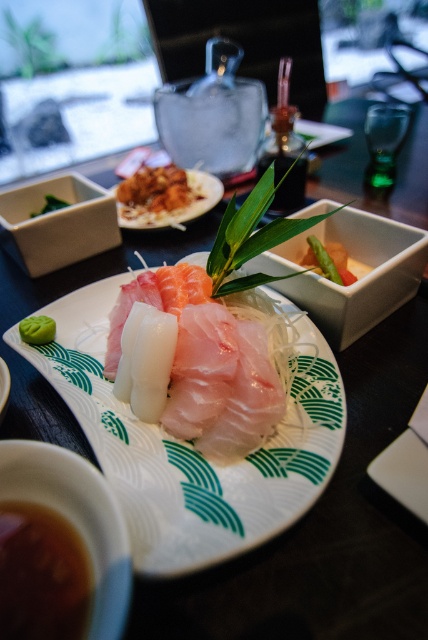
From the picture: Which is above, brown translucent bowl at lower left or white matte bowl at center-left?

Positioned higher is white matte bowl at center-left.

Which is more to the left, brown translucent bowl at lower left or white matte bowl at center-left?

Positioned to the left is white matte bowl at center-left.

The image size is (428, 640). Describe the element at coordinates (59, 547) in the screenshot. I see `brown translucent bowl at lower left` at that location.

Image resolution: width=428 pixels, height=640 pixels. I want to click on brown translucent bowl at lower left, so click(59, 547).

In order to click on white matte bowl at center-left in this screenshot , I will do `click(56, 224)`.

Can you confirm if white matte bowl at center-left is positioned above smooth green asparagus at center?

Correct, white matte bowl at center-left is located above smooth green asparagus at center.

Measure the distance between white matte bowl at center-left and camera.

They are 31.22 inches apart.

Locate an element on the screen. This screenshot has width=428, height=640. white matte bowl at center-left is located at coordinates (56, 224).

Can you confirm if pink translucent fish at center is thinner than green matte wasabi at center?

No.

Can you confirm if pink translucent fish at center is wider than green matte wasabi at center?

Indeed, pink translucent fish at center has a greater width compared to green matte wasabi at center.

The height and width of the screenshot is (640, 428). What do you see at coordinates (198, 360) in the screenshot? I see `pink translucent fish at center` at bounding box center [198, 360].

Locate an element on the screen. This screenshot has width=428, height=640. pink translucent fish at center is located at coordinates (198, 360).